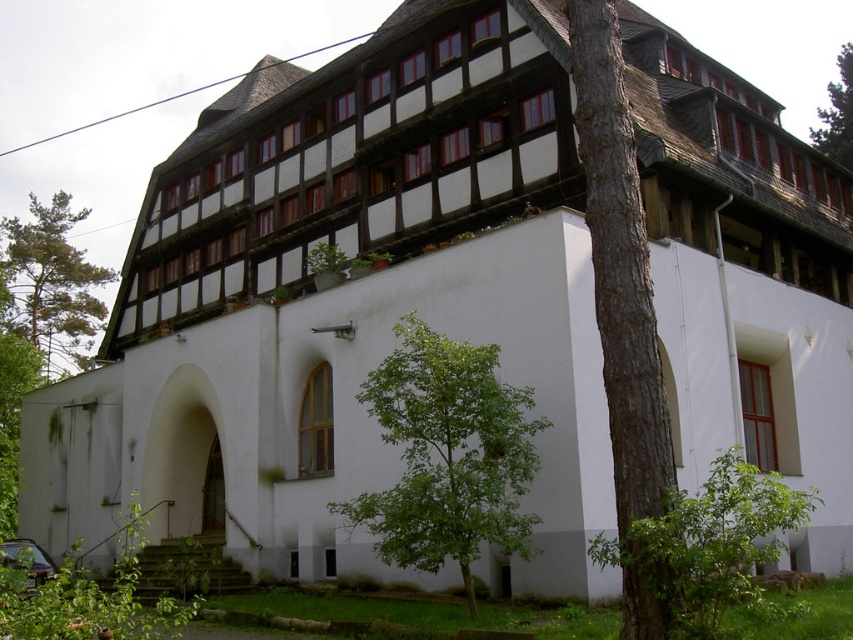
You are standing in front of the building and notice a point marked at coordinates (447,456). Based on the scene description, what object is located at that point?

The point at coordinates (447,456) corresponds to the green leafy tree at center.

You are standing in front of the building and notice two green leafy trees. One is labeled as green leafy tree at center and the other as green leafy tree at left. Which tree is positioned more to the left side of the building?

The green leafy tree at left is positioned more to the left side of the building compared to the green leafy tree at center, which is to its right.